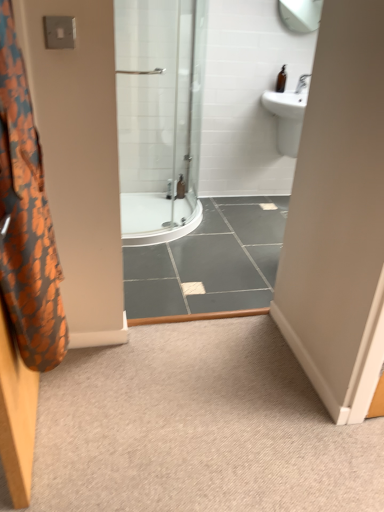
Question: Is the position of clear plastic bottle at center, positioned as the second toiletry in right-to-left order, less distant than that of carpet at center?

Choices:
 (A) no
 (B) yes

Answer: (A)

Question: Is clear plastic bottle at center, the second toiletry from the top, shorter than carpet at center?

Choices:
 (A) yes
 (B) no

Answer: (B)

Question: Can you confirm if clear plastic bottle at center, which appears as the first toiletry when viewed from the left, is positioned to the left of carpet at center?

Choices:
 (A) no
 (B) yes

Answer: (B)

Question: Is clear plastic bottle at center, the 1th toiletry positioned from the back, not within carpet at center?

Choices:
 (A) no
 (B) yes

Answer: (B)

Question: From a real-world perspective, is clear plastic bottle at center, the 1th toiletry positioned from the back, located beneath carpet at center?

Choices:
 (A) yes
 (B) no

Answer: (B)

Question: From a real-world perspective, is brown glass bottle at upper right, marked as the second toiletry in a left-to-right arrangement, physically located above or below white glossy sink at upper right?

Choices:
 (A) above
 (B) below

Answer: (A)

Question: In the image, is brown glass bottle at upper right, which is counted as the 1th toiletry, starting from the top, positioned in front of or behind white glossy sink at upper right?

Choices:
 (A) behind
 (B) front

Answer: (A)

Question: Is point (279, 82) positioned closer to the camera than point (271, 96)?

Choices:
 (A) farther
 (B) closer

Answer: (A)

Question: In terms of height, does brown glass bottle at upper right, which is the first toiletry from right to left, look taller or shorter compared to white glossy sink at upper right?

Choices:
 (A) tall
 (B) short

Answer: (B)

Question: Does point (299, 117) appear closer or farther from the camera than point (279, 90)?

Choices:
 (A) closer
 (B) farther

Answer: (A)

Question: Based on their sizes in the image, would you say white glossy sink at upper right is bigger or smaller than brown glass bottle at upper right, marked as the second toiletry in a left-to-right arrangement?

Choices:
 (A) big
 (B) small

Answer: (A)

Question: Is white glossy sink at upper right wider or thinner than brown glass bottle at upper right, marked as the second toiletry in a left-to-right arrangement?

Choices:
 (A) thin
 (B) wide

Answer: (B)

Question: In terms of height, does white glossy sink at upper right look taller or shorter compared to brown glass bottle at upper right, marked as the second toiletry in a left-to-right arrangement?

Choices:
 (A) tall
 (B) short

Answer: (A)

Question: Is orange fabric shower curtain at left in front of or behind brown glass bottle at upper right, marked as the 1th toiletry in a front-to-back arrangement, in the image?

Choices:
 (A) behind
 (B) front

Answer: (B)

Question: Looking at their shapes, would you say orange fabric shower curtain at left is wider or thinner than brown glass bottle at upper right, marked as the second toiletry in a left-to-right arrangement?

Choices:
 (A) thin
 (B) wide

Answer: (B)